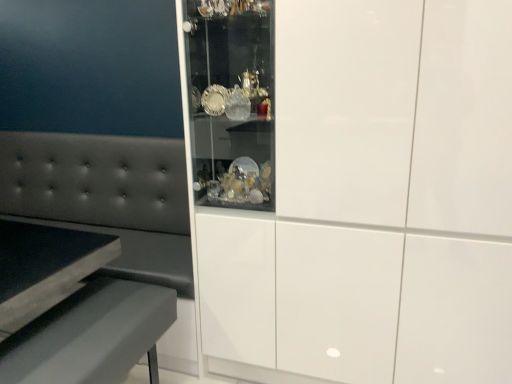
Question: Is tufted leather couch at left positioned beyond the bounds of matte gray table at lower left?

Choices:
 (A) yes
 (B) no

Answer: (A)

Question: Does tufted leather couch at left contain matte gray table at lower left?

Choices:
 (A) yes
 (B) no

Answer: (B)

Question: From the image's perspective, is tufted leather couch at left over matte gray table at lower left?

Choices:
 (A) yes
 (B) no

Answer: (A)

Question: From the image's perspective, is tufted leather couch at left under matte gray table at lower left?

Choices:
 (A) yes
 (B) no

Answer: (B)

Question: From a real-world perspective, is tufted leather couch at left positioned over matte gray table at lower left based on gravity?

Choices:
 (A) no
 (B) yes

Answer: (B)

Question: From their relative heights in the image, would you say tufted leather couch at left is taller or shorter than white glossy cabinet at center?

Choices:
 (A) short
 (B) tall

Answer: (A)

Question: Which is correct: tufted leather couch at left is inside white glossy cabinet at center, or outside of it?

Choices:
 (A) inside
 (B) outside

Answer: (B)

Question: Is tufted leather couch at left to the left or to the right of white glossy cabinet at center in the image?

Choices:
 (A) right
 (B) left

Answer: (B)

Question: Is tufted leather couch at left wider or thinner than white glossy cabinet at center?

Choices:
 (A) wide
 (B) thin

Answer: (B)

Question: Considering their positions, is tufted leather couch at left located in front of or behind matte gray table at lower left?

Choices:
 (A) front
 (B) behind

Answer: (B)

Question: From the image's perspective, relative to matte gray table at lower left, is tufted leather couch at left above or below?

Choices:
 (A) below
 (B) above

Answer: (B)

Question: In terms of size, does tufted leather couch at left appear bigger or smaller than matte gray table at lower left?

Choices:
 (A) small
 (B) big

Answer: (B)

Question: Would you say tufted leather couch at left is inside or outside matte gray table at lower left?

Choices:
 (A) outside
 (B) inside

Answer: (A)

Question: Looking at their shapes, would you say matte gray table at lower left is wider or thinner than tufted leather couch at left?

Choices:
 (A) thin
 (B) wide

Answer: (A)

Question: Is matte gray table at lower left bigger or smaller than tufted leather couch at left?

Choices:
 (A) big
 (B) small

Answer: (B)